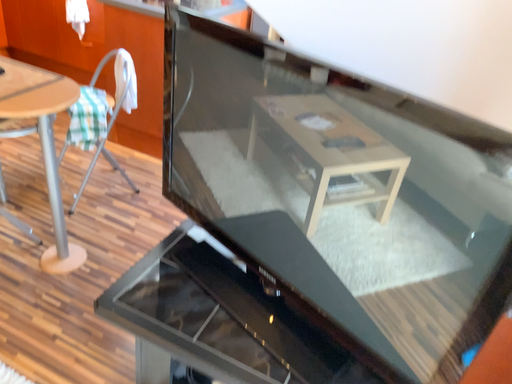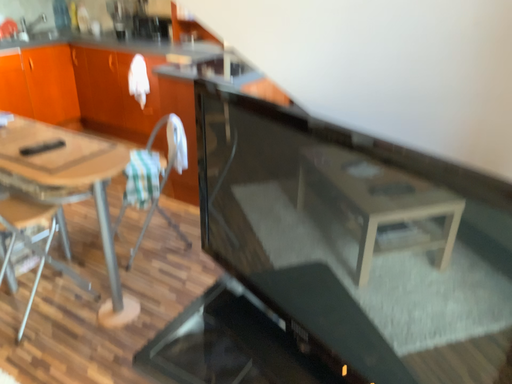
Question: Which way did the camera rotate in the video?

Choices:
 (A) rotated left
 (B) rotated right

Answer: (A)